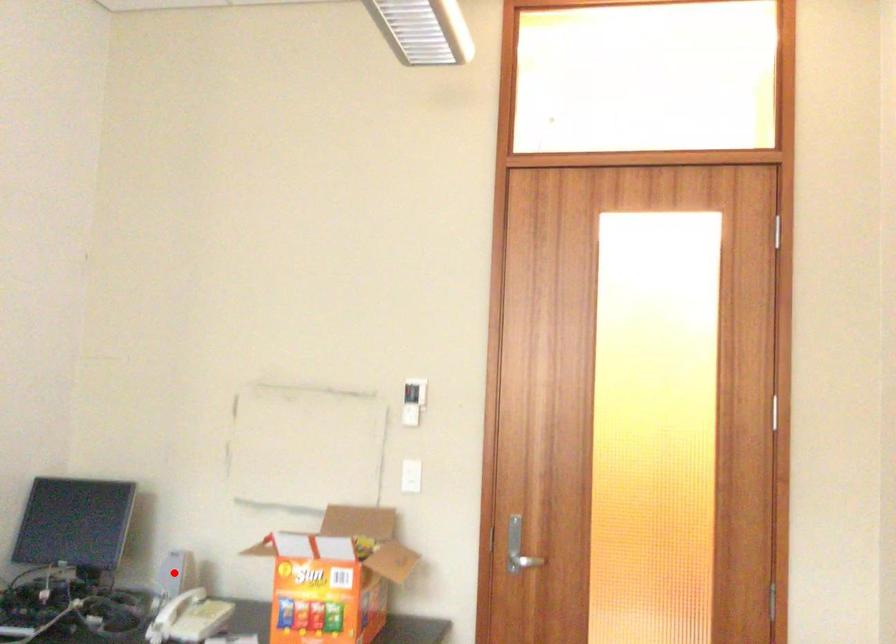
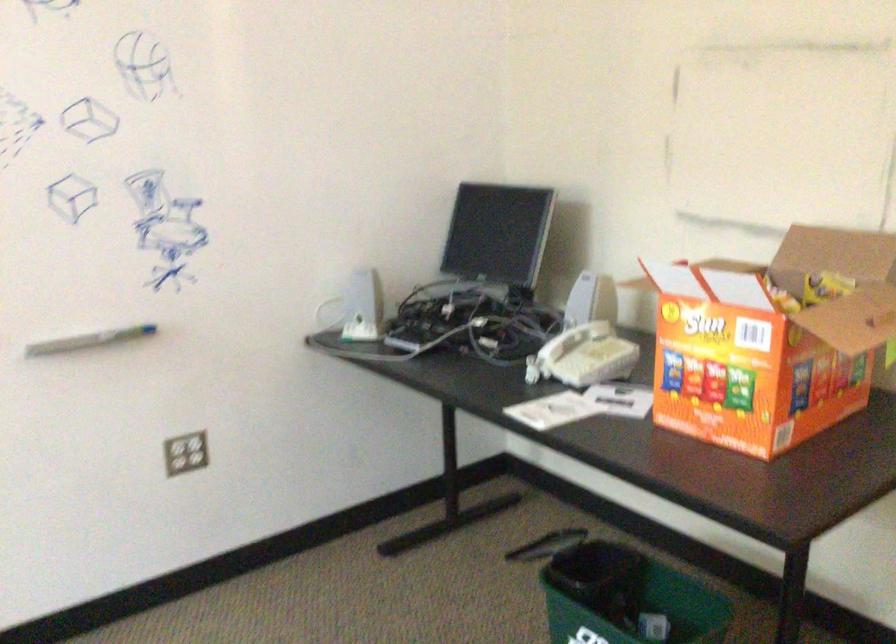
In the second image, find the point that corresponds to the highlighted location in the first image.

(579, 305)